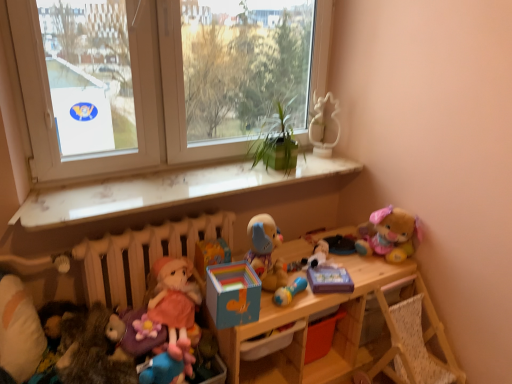
Question: Does fluffy plush bear at upper right, placed as the 7th toy when sorted from left to right, come behind transparent glass window at center, which ranks as the second window screen in left-to-right order?

Choices:
 (A) no
 (B) yes

Answer: (B)

Question: From the image's perspective, is fluffy plush bear at upper right, which ranks as the first toy in right-to-left order, located above transparent glass window at center, which is the 1th window screen from right to left?

Choices:
 (A) yes
 (B) no

Answer: (B)

Question: Does fluffy plush bear at upper right, placed as the 7th toy when sorted from left to right, have a lesser width compared to transparent glass window at center, which ranks as the second window screen in left-to-right order?

Choices:
 (A) no
 (B) yes

Answer: (A)

Question: From the image's perspective, is fluffy plush bear at upper right, which ranks as the first toy in right-to-left order, under transparent glass window at center, which ranks as the second window screen in left-to-right order?

Choices:
 (A) yes
 (B) no

Answer: (A)

Question: Does fluffy plush bear at upper right, placed as the 7th toy when sorted from left to right, have a smaller size compared to transparent glass window at center, which is the 1th window screen from right to left?

Choices:
 (A) yes
 (B) no

Answer: (A)

Question: In the image, is white soft pillow at lower left on the left side or the right side of transparent glass window at center, which ranks as the second window screen in left-to-right order?

Choices:
 (A) left
 (B) right

Answer: (A)

Question: Is white soft pillow at lower left wider or thinner than transparent glass window at center, which is the 1th window screen from right to left?

Choices:
 (A) wide
 (B) thin

Answer: (A)

Question: In terms of size, does white soft pillow at lower left appear bigger or smaller than transparent glass window at center, which is the 1th window screen from right to left?

Choices:
 (A) big
 (B) small

Answer: (B)

Question: Do you think white soft pillow at lower left is within transparent glass window at center, which is the 1th window screen from right to left, or outside of it?

Choices:
 (A) outside
 (B) inside

Answer: (A)

Question: Visually, is woven fabric feeding chair at lower right positioned to the left or to the right of white matte radiator at lower left?

Choices:
 (A) right
 (B) left

Answer: (A)

Question: Considering the positions of woven fabric feeding chair at lower right and white matte radiator at lower left in the image, is woven fabric feeding chair at lower right bigger or smaller than white matte radiator at lower left?

Choices:
 (A) small
 (B) big

Answer: (B)

Question: Is point (439, 372) closer or farther from the camera than point (123, 271)?

Choices:
 (A) closer
 (B) farther

Answer: (B)

Question: From the image's perspective, is woven fabric feeding chair at lower right above or below white matte radiator at lower left?

Choices:
 (A) below
 (B) above

Answer: (A)

Question: Is point (287, 299) positioned closer to the camera than point (110, 137)?

Choices:
 (A) farther
 (B) closer

Answer: (B)

Question: Based on their sizes in the image, would you say blue rubber rattle at center, placed as the sixth toy when sorted from left to right, is bigger or smaller than white paper at upper left, positioned as the 2th window screen in right-to-left order?

Choices:
 (A) big
 (B) small

Answer: (B)